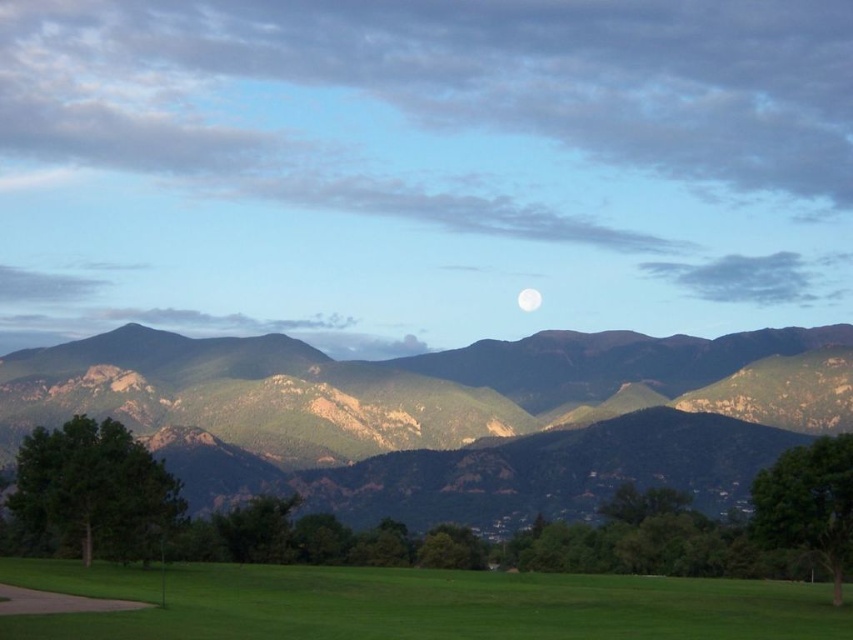
Identify the location of green textured mountains at center. (448, 412).

Between point (209, 401) and point (695, 604), which one is positioned in front?

Positioned in front is point (695, 604).

Between point (814, 403) and point (444, 609), which one is positioned behind?

The point (814, 403) is behind.

This screenshot has width=853, height=640. In order to click on green textured mountains at center in this screenshot , I will do `click(448, 412)`.

Can you confirm if green textured mountains at center is smaller than white glossy moon at center?

Actually, green textured mountains at center might be larger than white glossy moon at center.

Is green textured mountains at center below white glossy moon at center?

Yes, green textured mountains at center is below white glossy moon at center.

What do you see at coordinates (448, 412) in the screenshot? This screenshot has height=640, width=853. I see `green textured mountains at center` at bounding box center [448, 412].

Identify the location of green textured mountains at center. The width and height of the screenshot is (853, 640). (448, 412).

Who is taller, green grass at lower center or white glossy moon at center?

green grass at lower center

Does green grass at lower center come behind white glossy moon at center?

No, it is in front of white glossy moon at center.

Between point (65, 634) and point (531, 307), which one is positioned in front?

Point (65, 634)

Identify the location of green grass at lower center. This screenshot has width=853, height=640. (453, 608).